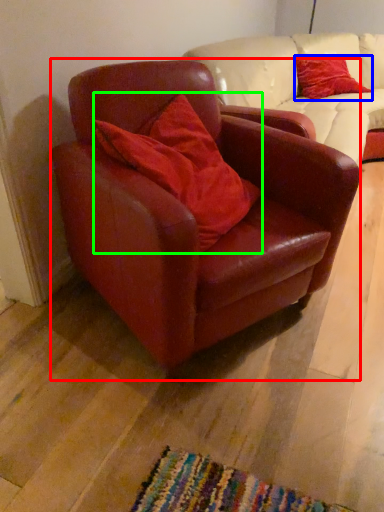
Question: Which object is positioned closest to chair (highlighted by a red box)? Select from pillow (highlighted by a blue box) and pillow (highlighted by a green box).

Choices:
 (A) pillow
 (B) pillow

Answer: (B)